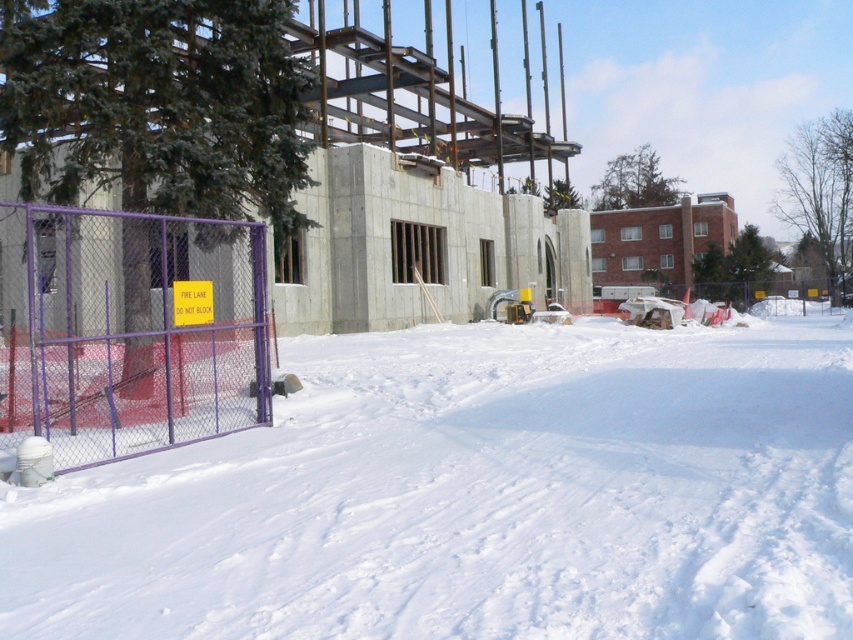
Does point (788, 374) come behind point (192, 333)?

Yes, it is behind point (192, 333).

Between point (553, 620) and point (44, 252), which one is positioned behind?

Positioned behind is point (44, 252).

Does point (590, 580) lie in front of point (171, 435)?

Yes, it is in front of point (171, 435).

Identify the location of white powdery snow at left. (474, 497).